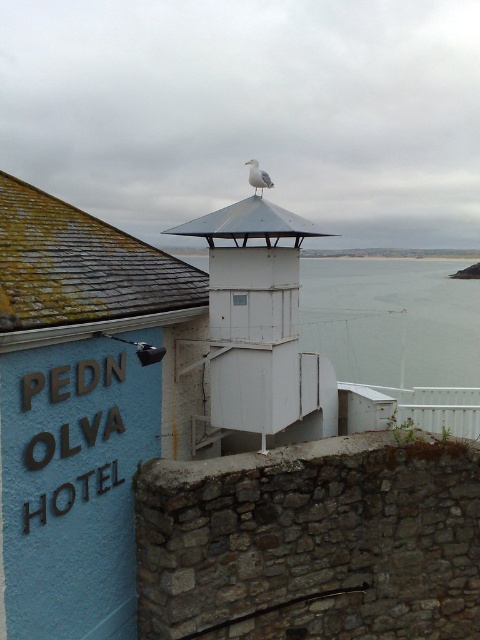
Between white matte tower at center and white feathered bird at upper center, which one has less height?

With less height is white matte tower at center.

Can you confirm if white matte tower at center is smaller than white feathered bird at upper center?

Incorrect, white matte tower at center is not smaller in size than white feathered bird at upper center.

Who is more forward, (250, 252) or (256, 161)?

Point (250, 252) is in front.

Where is `white matte tower at center`? white matte tower at center is located at coordinates (259, 332).

Which is behind, point (217, 394) or point (459, 358)?

Positioned behind is point (459, 358).

Between point (316, 392) and point (332, 332), which one is positioned in front?

Positioned in front is point (316, 392).

I want to click on white matte tower at center, so click(x=259, y=332).

Can you confirm if transparent glass water at center is positioned below white feathered bird at upper center?

Yes, transparent glass water at center is below white feathered bird at upper center.

Measure the distance between transparent glass water at center and white feathered bird at upper center.

transparent glass water at center and white feathered bird at upper center are 15.49 meters apart from each other.

Is point (393, 364) farther from viewer compared to point (252, 163)?

Yes, it is.

Where is `transparent glass water at center`? The height and width of the screenshot is (640, 480). transparent glass water at center is located at coordinates (392, 320).